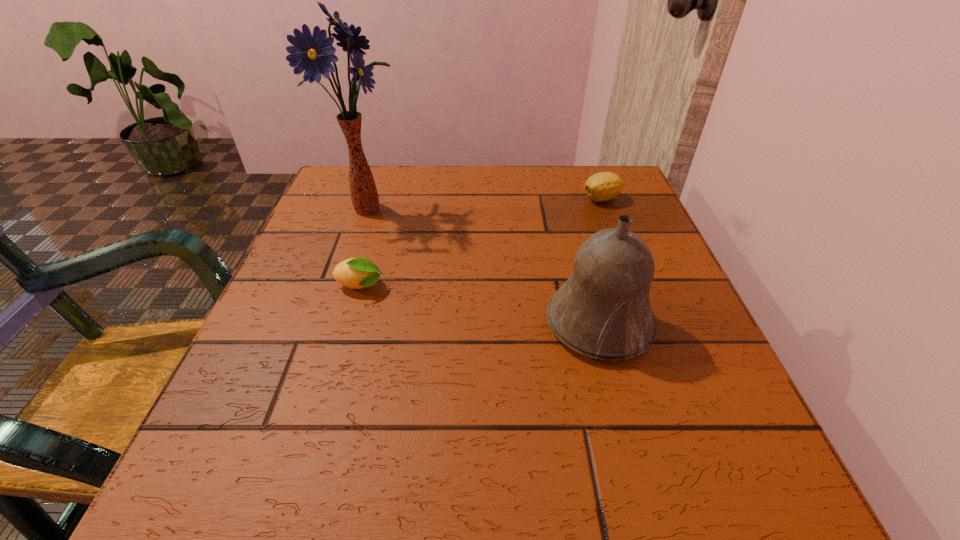
Locate an element on the screen. flower arrangement is located at coordinates (313, 53).

Locate an element on the screen. bell is located at coordinates (603, 311).

The width and height of the screenshot is (960, 540). I want to click on the right lemon, so point(604,186).

Where is `the left lemon`? The height and width of the screenshot is (540, 960). the left lemon is located at coordinates (356, 273).

Where is `free space located 0.260m on the front of the flower arrangement`? free space located 0.260m on the front of the flower arrangement is located at coordinates (333, 316).

Locate an element on the screen. The image size is (960, 540). vacant position located on the back of the bell is located at coordinates (565, 199).

Where is `vacant area situated 0.060m at the stem end of the right lemon`? vacant area situated 0.060m at the stem end of the right lemon is located at coordinates (556, 199).

Identify the location of vacant space situated 0.080m at the stem end of the right lemon. (547, 199).

In order to click on free location located at the stem end of the right lemon in this screenshot , I will do `click(469, 199)`.

Locate an element on the screen. The image size is (960, 540). vacant space located 0.240m with leaves positioned above the nearer lemon is located at coordinates (518, 286).